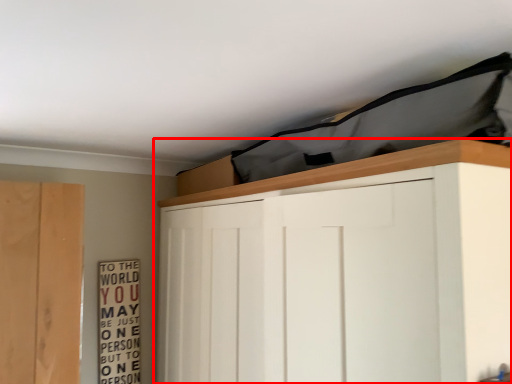
Question: In this image, where is cupboard (annotated by the red box) located relative to bulletin board?

Choices:
 (A) left
 (B) right

Answer: (B)